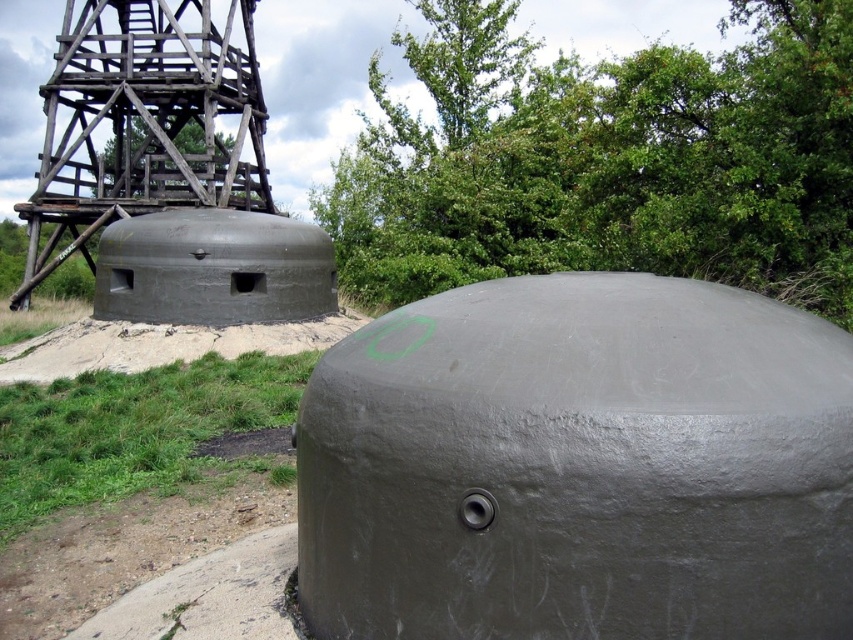
Question: Is gray concrete dome at center above gray concrete turret at center?

Choices:
 (A) no
 (B) yes

Answer: (A)

Question: Can you confirm if gray concrete dome at center is positioned to the left of gray concrete turret at center?

Choices:
 (A) no
 (B) yes

Answer: (A)

Question: Which object appears farthest from the camera in this image?

Choices:
 (A) gray concrete turret at center
 (B) gray concrete dome at center

Answer: (A)

Question: Estimate the real-world distances between objects in this image. Which object is closer to the gray concrete turret at center?

Choices:
 (A) gray concrete dome at center
 (B) gray concrete at lower left

Answer: (B)

Question: Does gray concrete turret at center have a larger size compared to gray concrete at lower left?

Choices:
 (A) no
 (B) yes

Answer: (B)

Question: Which object is closer to the camera taking this photo?

Choices:
 (A) gray concrete at lower left
 (B) gray concrete turret at center

Answer: (A)